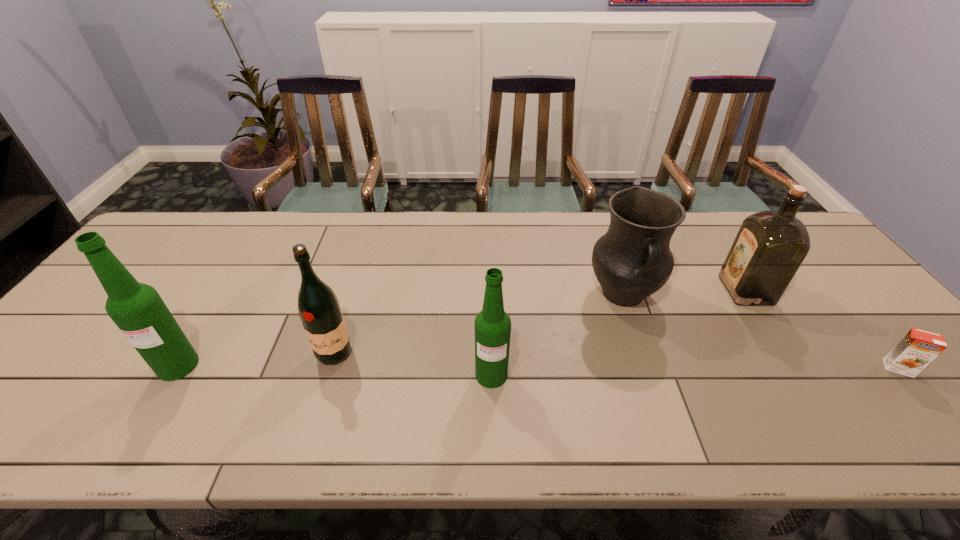
Locate an element on the screen. The height and width of the screenshot is (540, 960). free point at the far edge is located at coordinates (581, 227).

Locate an element on the screen. The image size is (960, 540). vacant space at the near edge is located at coordinates (684, 376).

Image resolution: width=960 pixels, height=540 pixels. What are the coordinates of `free spot at the left edge of the desktop` in the screenshot? It's located at (114, 339).

Find the location of a particular element. This screenshot has width=960, height=540. vacant space at the far left corner is located at coordinates (210, 216).

At what (x,y) coordinates should I click in order to perform the action: click on free area in between the right beer bottle and the farther liquor. Please return your answer as a coordinate pair (x, y). The width and height of the screenshot is (960, 540). Looking at the image, I should click on (618, 333).

You are a GUI agent. You are given a task and a screenshot of the screen. Output one action in this format:
    pyautogui.click(x=<x>, y=<y>)
    Task: Click on the vacant space in between the right liquor and the pitcher
    
    Given the screenshot: What is the action you would take?
    pyautogui.click(x=684, y=293)

Locate an element on the screen. The height and width of the screenshot is (540, 960). unoccupied area between the right liquor and the leftmost object is located at coordinates (462, 328).

Where is `vacant space in between the third object from right to left and the right beer bottle`? vacant space in between the third object from right to left and the right beer bottle is located at coordinates (557, 335).

Identify the location of unoccupied area between the shorter beer bottle and the farther liquor. (618, 333).

I want to click on vacant region between the farther liquor and the left beer bottle, so click(462, 328).